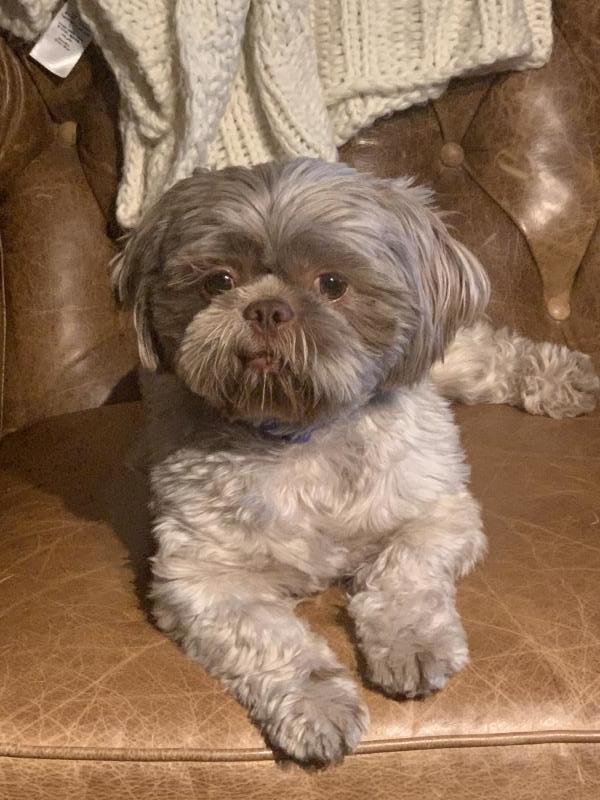
The width and height of the screenshot is (600, 800). What are the coordinates of `chair` in the screenshot? It's located at (527, 521).